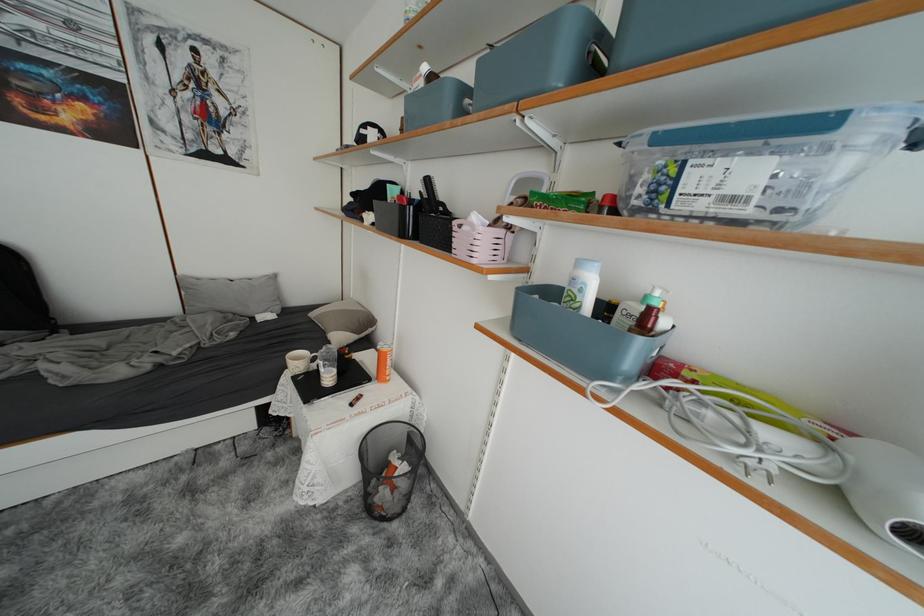
Where would you clos the white bottle cap? Please return your answer as a coordinate pair (x, y).

(423, 69)